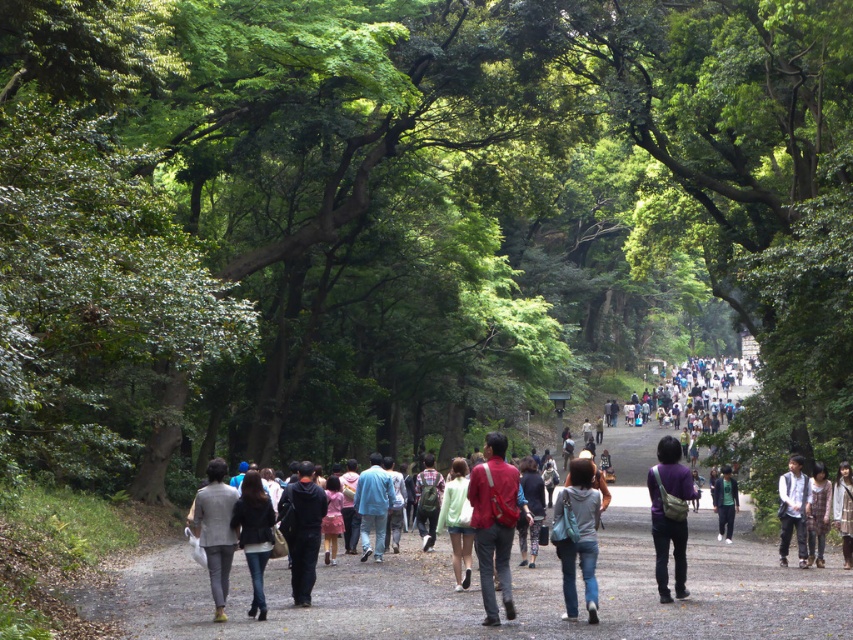
Is point (502, 456) closer to viewer compared to point (817, 500)?

Yes, point (502, 456) is in front of point (817, 500).

This screenshot has height=640, width=853. Find the location of `matte red backpack at center`. matte red backpack at center is located at coordinates (492, 522).

Can you confirm if light brown fabric coat at lower right is smaller than green cotton shirt at center?

Yes, light brown fabric coat at lower right is smaller than green cotton shirt at center.

Which is more to the right, light brown fabric coat at lower right or green cotton shirt at center?

Positioned to the right is green cotton shirt at center.

Locate an element on the screen. light brown fabric coat at lower right is located at coordinates (843, 509).

Find the location of `light brown fabric coat at lower right`. light brown fabric coat at lower right is located at coordinates (843, 509).

Is green knapsack at center above green cotton shirt at center?

Correct, green knapsack at center is located above green cotton shirt at center.

Who is positioned more to the left, green knapsack at center or green cotton shirt at center?

Positioned to the left is green knapsack at center.

Is point (428, 483) less distant than point (734, 490)?

Yes, point (428, 483) is closer to viewer.

The image size is (853, 640). I want to click on green knapsack at center, so click(427, 500).